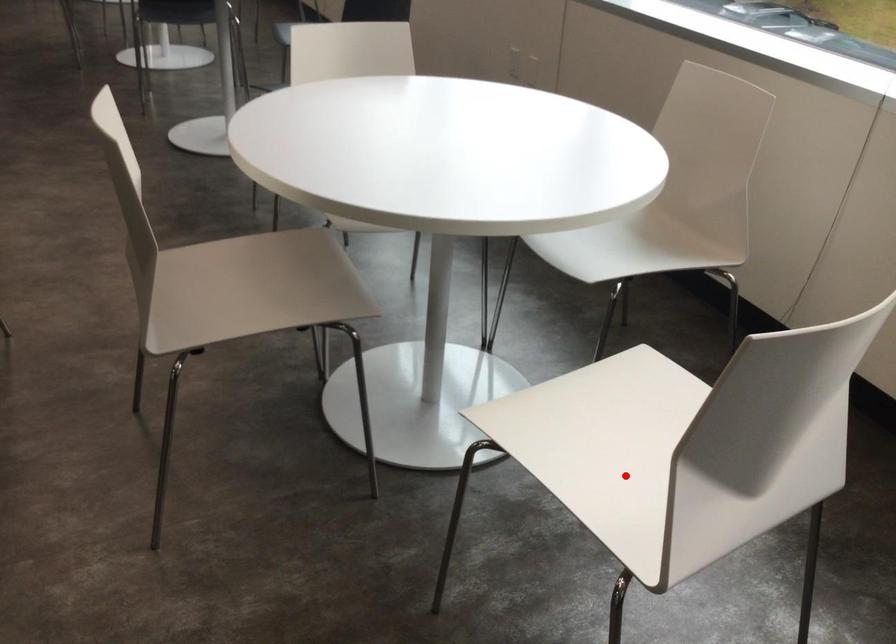
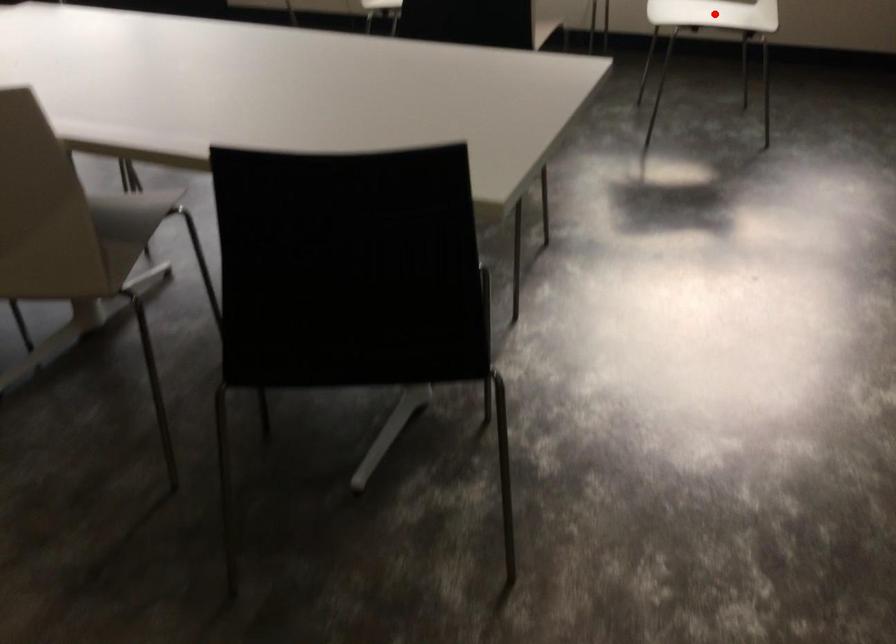
I am providing you with two images of the same scene from different viewpoints. A red point is marked on the first image and another point is marked on the second image. Are the points marked in image1 and image2 representing the same 3D position?

Yes